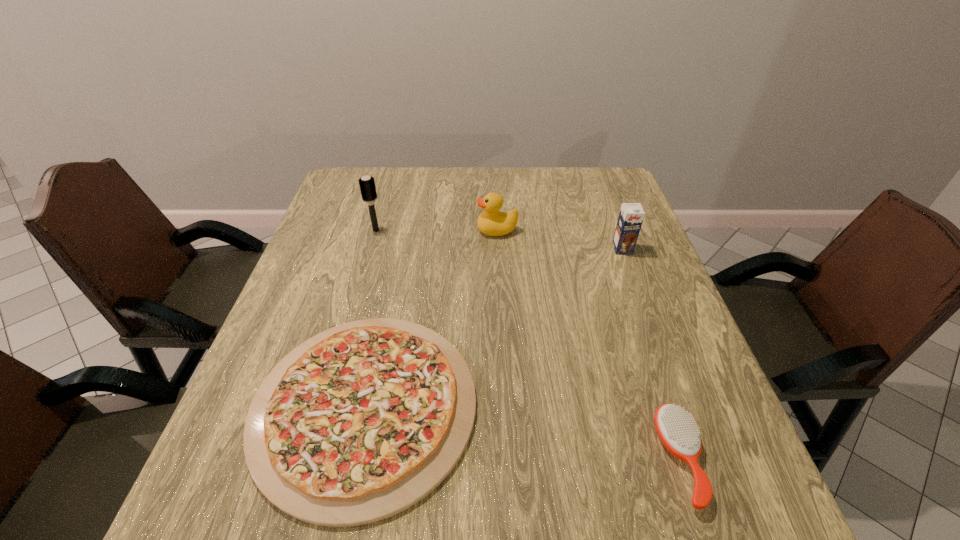
Where is `object situated at the near left corner`? The image size is (960, 540). object situated at the near left corner is located at coordinates (360, 422).

The width and height of the screenshot is (960, 540). I want to click on object present at the near right corner, so [x=678, y=432].

The width and height of the screenshot is (960, 540). I want to click on vacant space at the far edge of the desktop, so coord(517,179).

Identify the location of vacant space at the left edge of the desktop. Image resolution: width=960 pixels, height=540 pixels. (315, 313).

Identify the location of vacant position at the right edge of the desktop. (641, 254).

Find the location of a particular element. Image resolution: width=960 pixels, height=540 pixels. free space at the far left corner is located at coordinates (351, 201).

The height and width of the screenshot is (540, 960). What are the coordinates of `vacant area between the chocolate milk and the third tallest object` in the screenshot? It's located at [560, 240].

You are a GUI agent. You are given a task and a screenshot of the screen. Output one action in this format:
    pyautogui.click(x=<x>, y=<y>)
    Task: Click on the free space between the third farthest object and the duck
    The image size is (960, 540).
    Given the screenshot: What is the action you would take?
    pyautogui.click(x=560, y=240)

Find the location of a particular element. The width and height of the screenshot is (960, 540). free space between the pizza and the left hairbrush is located at coordinates (371, 318).

Locate an element on the screen. free spot between the shorter hairbrush and the farther hairbrush is located at coordinates (528, 345).